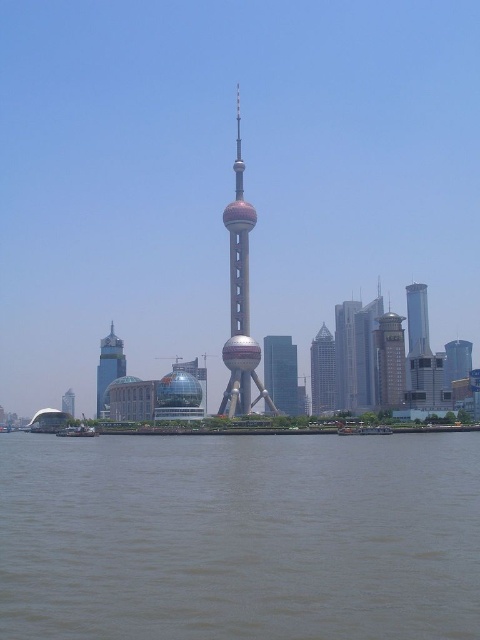
Question: Is glassy silver skyscraper at center thinner than metallic silver boat at lower left?

Choices:
 (A) no
 (B) yes

Answer: (B)

Question: Which point appears farthest from the camera in this image?

Choices:
 (A) click(324, 342)
 (B) click(343, 364)
 (C) click(333, 636)
 (D) click(425, 324)

Answer: (D)

Question: Based on their relative distances, which object is farther from the brown water at lower center?

Choices:
 (A) shiny silver skyscraper at lower left
 (B) metallic silver boat at lower left
 (C) glassy silver skyscraper at center right

Answer: (C)

Question: Among these objects, which one is nearest to the camera?

Choices:
 (A) brown water at lower center
 (B) brick red brick building at center

Answer: (A)

Question: Is brown water at lower center bigger than smooth silver tower at right?

Choices:
 (A) no
 (B) yes

Answer: (B)

Question: Is brown water at lower center bigger than shiny silver dome at lower left?

Choices:
 (A) yes
 (B) no

Answer: (A)